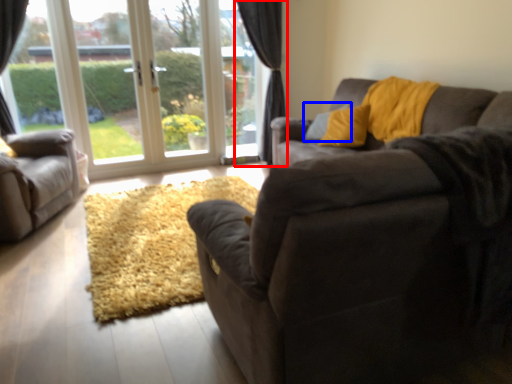
Question: Among these objects, which one is nearest to the camera, curtain (highlighted by a red box) or pillow (highlighted by a blue box)?

Choices:
 (A) curtain
 (B) pillow

Answer: (B)